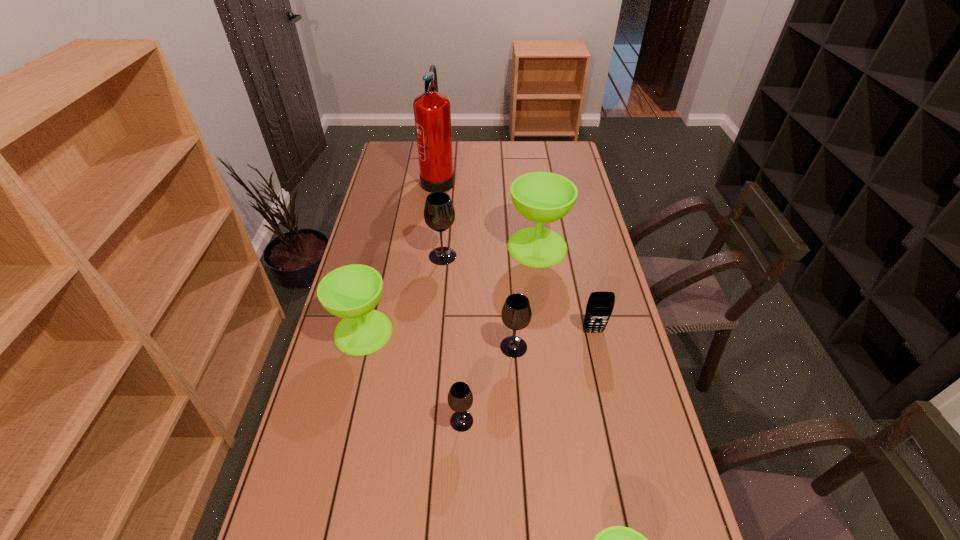
Where is `free space between the fifth object from right to left and the cellular telephone`? This screenshot has height=540, width=960. free space between the fifth object from right to left and the cellular telephone is located at coordinates (527, 376).

Locate an element on the screen. The width and height of the screenshot is (960, 540). the fifth closest object relative to the second farthest gray wineglass is located at coordinates (439, 214).

The width and height of the screenshot is (960, 540). What are the coordinates of `object that is the third closest to the tallest object` in the screenshot? It's located at pyautogui.click(x=351, y=292).

Point out which wineglass is positioned as the nearest to the second nearest object. Please provide its 2D coordinates. Your answer should be formatted as a tuple, i.e. [(x, y)], where the tuple contains the x and y coordinates of a point satisfying the conditions above.

[(516, 314)]

Where is `wineglass that stands as the fourth closest to the farthest gray wineglass`? This screenshot has height=540, width=960. wineglass that stands as the fourth closest to the farthest gray wineglass is located at coordinates (460, 398).

At what (x,y) coordinates should I click in order to perform the action: click on gray wineglass that is the third nearest to the fire extinguisher. Please return your answer as a coordinate pair (x, y). Looking at the image, I should click on (460, 398).

Where is `gray wineglass that is the closest one to the fifth farthest wineglass`? This screenshot has height=540, width=960. gray wineglass that is the closest one to the fifth farthest wineglass is located at coordinates (516, 314).

Where is `green wineglass that is the third closest to the fire extinguisher`? green wineglass that is the third closest to the fire extinguisher is located at coordinates (616, 539).

Where is `green wineglass that stands as the closest to the cellular telephone`? green wineglass that stands as the closest to the cellular telephone is located at coordinates (542, 197).

Where is `vacant space that satisfies the following two spatial constraints: 1. on the back side of the biggest green wineglass; 2. on the left side of the fourth object from left to right`? vacant space that satisfies the following two spatial constraints: 1. on the back side of the biggest green wineglass; 2. on the left side of the fourth object from left to right is located at coordinates (468, 247).